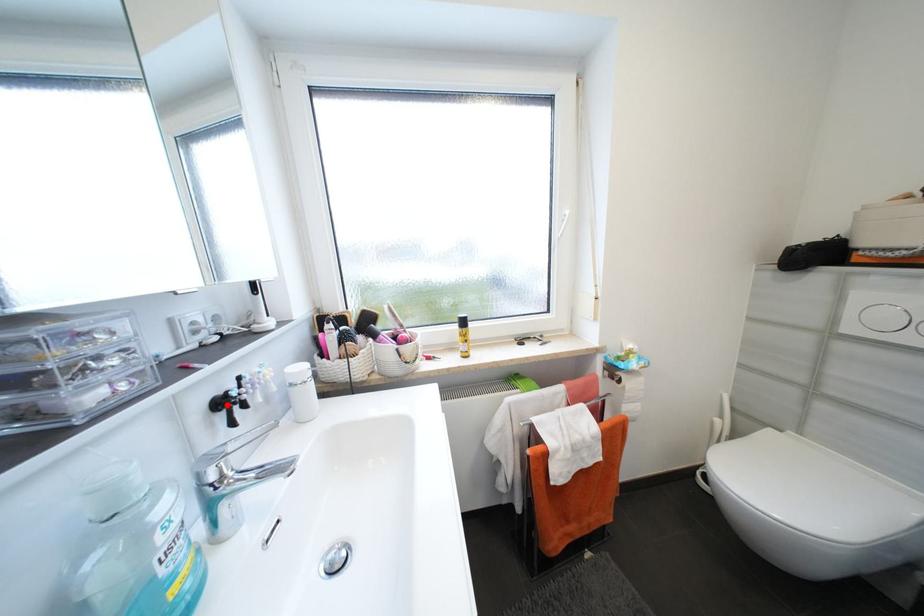
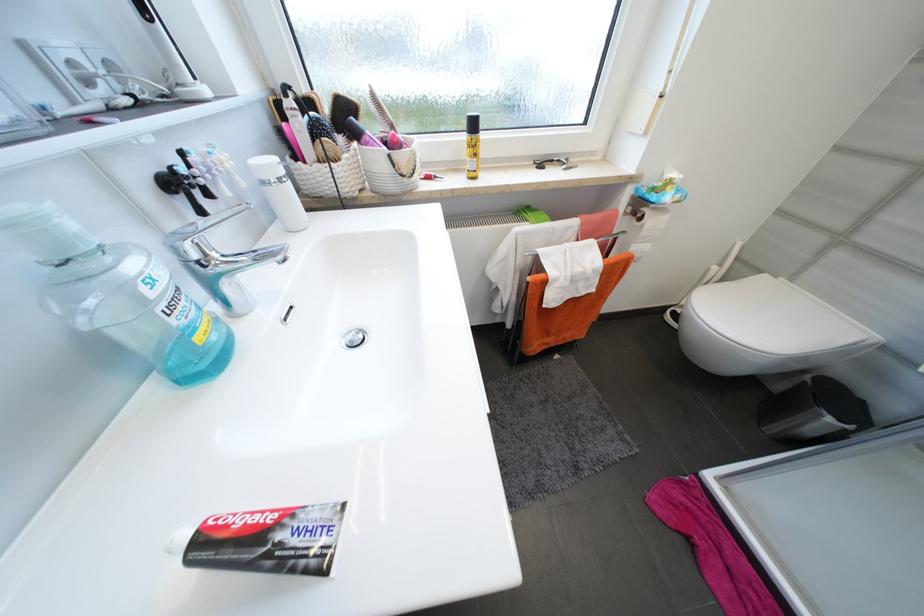
In the second image, find the point that corresponds to the highlighted location in the first image.

(178, 185)